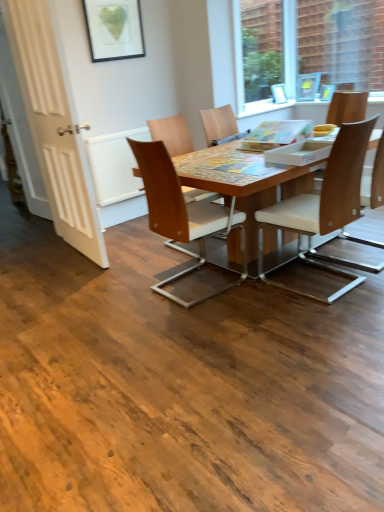
Question: Based on their positions, is light brown wood chair at right, acting as the fourth chair starting from the left, located to the left or right of transparent glass window at upper right?

Choices:
 (A) right
 (B) left

Answer: (B)

Question: Considering their positions, is light brown wood chair at right, the 2th chair in the right-to-left sequence, located in front of or behind transparent glass window at upper right?

Choices:
 (A) front
 (B) behind

Answer: (A)

Question: Which is nearer to the white wooden door at left?

Choices:
 (A) light brown wood chair at right, the fifth chair from the left
 (B) woodenmaterial/texturetable at center
 (C) wooden chair at center, the 5th chair positioned from the right
 (D) wooden chair at center, which is the fourth chair in right-to-left order
 (E) wooden chair with white cushion at center, the third chair from the left

Answer: (C)

Question: Which object is positioned farthest from the wooden chair at center, which appears as the 2th chair when viewed from the left?

Choices:
 (A) wooden chair with white cushion at center, marked as the third chair in a right-to-left arrangement
 (B) transparent glass window at upper right
 (C) white wooden door at left
 (D) light brown wood chair at right, acting as the fourth chair starting from the left
 (E) wooden chair at center, the 5th chair positioned from the right

Answer: (B)